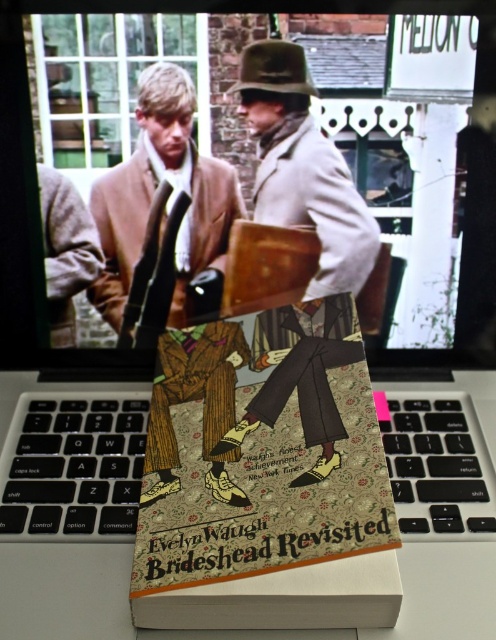
In the scene shown: What is the color of the coat at the point specified by coordinates [307,176]?

The color of the coat at the point specified by coordinates [307,176] is light beige.

You are organizing a display for a literature festival. You have a light beige wool coat at center and a patterned paper book at center. Which object should you place higher on the shelf to ensure the coat is visible above the book?

The light beige wool coat at center has a greater height compared to the patterned paper book at center, so placing the coat higher on the shelf will ensure it is visible above the book.

You are a tailor who needs to measure the distance between the light beige wool coat at center and yourself. Based on the image, can you determine if this distance is sufficient to comfortably adjust the coat sleeves?

The distance between the light beige wool coat at center and the viewer is 59.81 centimeters, which is sufficient to comfortably adjust the coat sleeves as this provides enough space for tailoring adjustments.